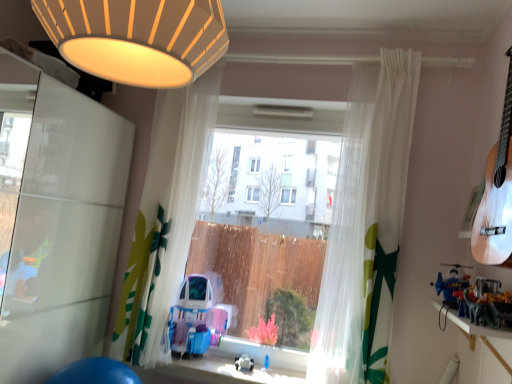
Question: From the image's perspective, does metallic silver dinosaur at right, which appears as the 2th toy when viewed from the left, appear lower than wooden shelf at lower right?

Choices:
 (A) yes
 (B) no

Answer: (B)

Question: Can you confirm if metallic silver dinosaur at right, placed as the third toy when sorted from bottom to top, is shorter than wooden shelf at lower right?

Choices:
 (A) no
 (B) yes

Answer: (B)

Question: Is metallic silver dinosaur at right, the second toy from the right, aimed at wooden shelf at lower right?

Choices:
 (A) yes
 (B) no

Answer: (B)

Question: Can we say metallic silver dinosaur at right, the second toy from the right, lies outside wooden shelf at lower right?

Choices:
 (A) yes
 (B) no

Answer: (A)

Question: Can you confirm if metallic silver dinosaur at right, which is the 3th toy in back-to-front order, is positioned to the right of wooden shelf at lower right?

Choices:
 (A) no
 (B) yes

Answer: (B)

Question: Is point (234, 367) closer or farther from the camera than point (468, 324)?

Choices:
 (A) closer
 (B) farther

Answer: (B)

Question: Do you think white plastic toy at center, which is the 1th toy in bottom-to-top order, is within wooden shelf at lower right, or outside of it?

Choices:
 (A) outside
 (B) inside

Answer: (A)

Question: Is white plastic toy at center, which is the 1th toy in bottom-to-top order, wider or thinner than wooden shelf at lower right?

Choices:
 (A) thin
 (B) wide

Answer: (A)

Question: Is white plastic toy at center, which is the 1th toy in bottom-to-top order, to the left or to the right of wooden shelf at lower right in the image?

Choices:
 (A) left
 (B) right

Answer: (A)

Question: From their relative heights in the image, would you say white plastic toy at center, which appears as the first toy when viewed from the back, is taller or shorter than translucent fabric curtain at center, placed as the second curtain when sorted from left to right?

Choices:
 (A) tall
 (B) short

Answer: (B)

Question: From the image's perspective, is white plastic toy at center, the first toy viewed from the left, positioned above or below translucent fabric curtain at center, placed as the second curtain when sorted from left to right?

Choices:
 (A) below
 (B) above

Answer: (A)

Question: From a real-world perspective, is white plastic toy at center, which is the 1th toy in bottom-to-top order, physically located above or below translucent fabric curtain at center, placed as the second curtain when sorted from left to right?

Choices:
 (A) below
 (B) above

Answer: (A)

Question: In terms of width, does white plastic toy at center, the first toy viewed from the left, look wider or thinner when compared to translucent fabric curtain at center, placed as the second curtain when sorted from left to right?

Choices:
 (A) thin
 (B) wide

Answer: (B)

Question: In terms of size, does metallic silver dinosaur at right, arranged as the 1th toy when viewed from the front, appear bigger or smaller than translucent fabric curtain at center, placed as the second curtain when sorted from left to right?

Choices:
 (A) small
 (B) big

Answer: (A)

Question: Is metallic silver dinosaur at right, which is the 3th toy in back-to-front order, inside or outside of translucent fabric curtain at center, placed as the second curtain when sorted from left to right?

Choices:
 (A) outside
 (B) inside

Answer: (A)